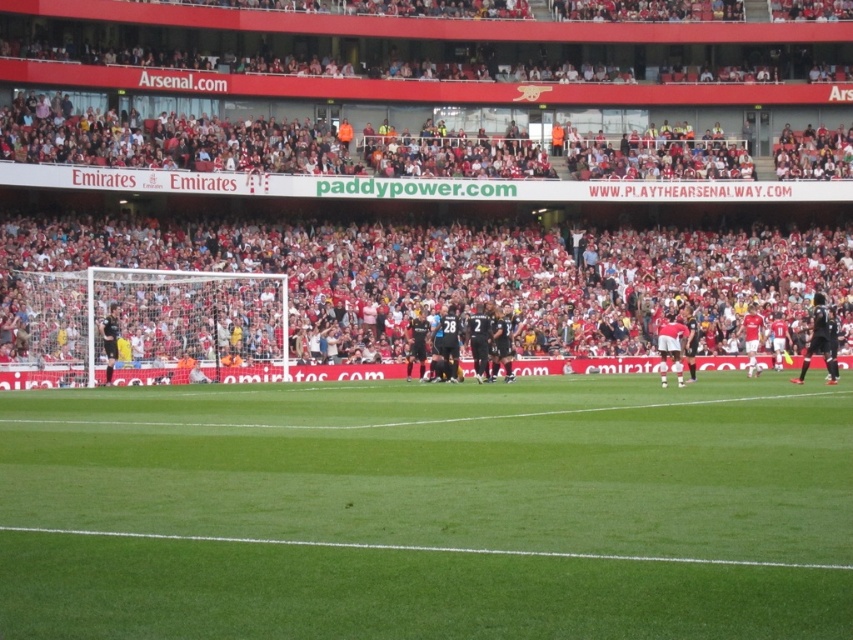
Is green grass at center thinner than red jersey at center?

In fact, green grass at center might be wider than red jersey at center.

Measure the distance between green grass at center and red jersey at center.

The distance of green grass at center from red jersey at center is 62.58 feet.

Which is in front, point (749, 577) or point (749, 364)?

Point (749, 577) is in front.

You are a GUI agent. You are given a task and a screenshot of the screen. Output one action in this format:
    pyautogui.click(x=<x>, y=<y>)
    Task: Click on the green grass at center
    This screenshot has height=640, width=853.
    Given the screenshot: What is the action you would take?
    pyautogui.click(x=428, y=509)

Can you confirm if white jersey at center is bigger than red jersey at center?

Indeed, white jersey at center has a larger size compared to red jersey at center.

Which is behind, point (682, 380) or point (751, 339)?

The point (751, 339) is more distant.

Between point (688, 340) and point (747, 372), which one is positioned behind?

Point (747, 372)

Locate an element on the screen. white jersey at center is located at coordinates (671, 346).

Does green grass at center appear over white jersey at center?

No, green grass at center is not above white jersey at center.

Find the location of a particular element. The width and height of the screenshot is (853, 640). green grass at center is located at coordinates (428, 509).

Image resolution: width=853 pixels, height=640 pixels. Find the location of `green grass at center`. green grass at center is located at coordinates (428, 509).